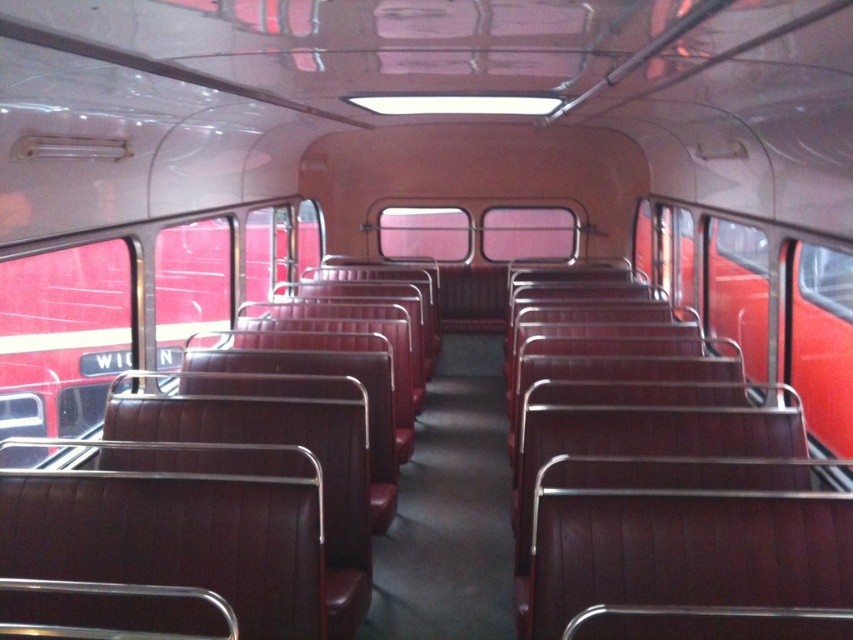
Question: Which object is the closest to the leather-like maroon seats at left?

Choices:
 (A) transparent glass window at upper right
 (B) matte glass window at center

Answer: (B)

Question: Which of the following is the closest to the observer?

Choices:
 (A) matte glass window at center
 (B) transparent glass window at upper right
 (C) leather-like maroon seats at left

Answer: (C)

Question: Observing the image, what is the correct spatial positioning of leather-like maroon seats at left in reference to transparent glass window at center?

Choices:
 (A) above
 (B) below

Answer: (B)

Question: Which object appears farthest from the camera in this image?

Choices:
 (A) transparent glass window at right
 (B) transparent glass window at upper right
 (C) leather-like maroon seats at left

Answer: (B)

Question: From the image, what is the correct spatial relationship of transparent glass window at center in relation to transparent glass window at right?

Choices:
 (A) below
 (B) above

Answer: (B)

Question: Can you confirm if transparent glass window at center is wider than transparent glass window at upper right?

Choices:
 (A) yes
 (B) no

Answer: (A)